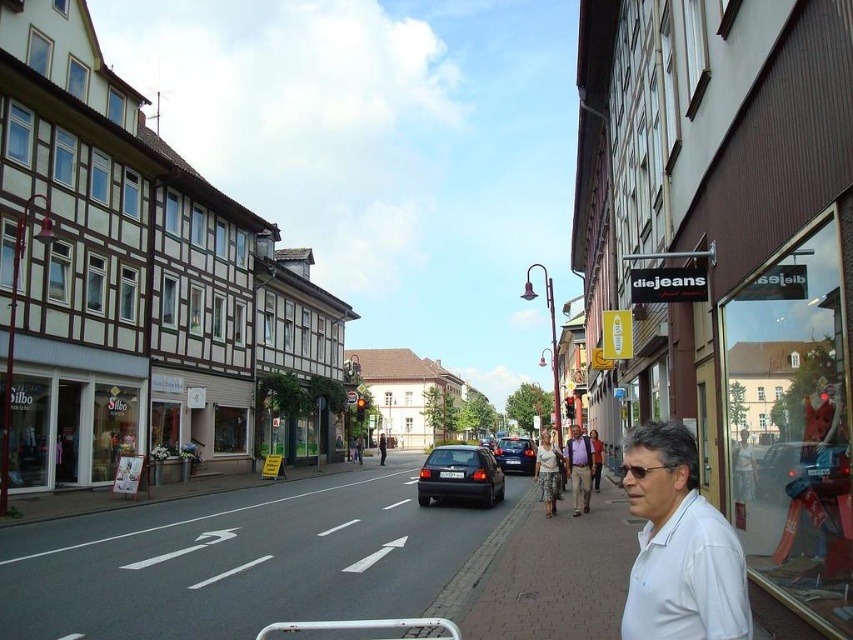
Question: Is white matte shirt at center to the left of white cotton blouse at center from the viewer's perspective?

Choices:
 (A) yes
 (B) no

Answer: (A)

Question: Can you confirm if metallic silver car at center is positioned to the left of shiny black sedan at center?

Choices:
 (A) yes
 (B) no

Answer: (A)

Question: In this image, where is white shirt at lower right located relative to shiny black sedan at center?

Choices:
 (A) left
 (B) right

Answer: (A)

Question: Which object appears farthest from the camera in this image?

Choices:
 (A) metallic silver car at center
 (B) shiny black sedan at center
 (C) white matte shirt at center
 (D) white shirt at lower right

Answer: (B)

Question: Which of the following is the closest to the observer?

Choices:
 (A) (514, 444)
 (B) (426, 497)
 (C) (634, 476)

Answer: (C)

Question: Which object is farther from the camera taking this photo?

Choices:
 (A) metallic silver car at center
 (B) shiny black hatchback at center
 (C) white cotton blouse at center

Answer: (B)